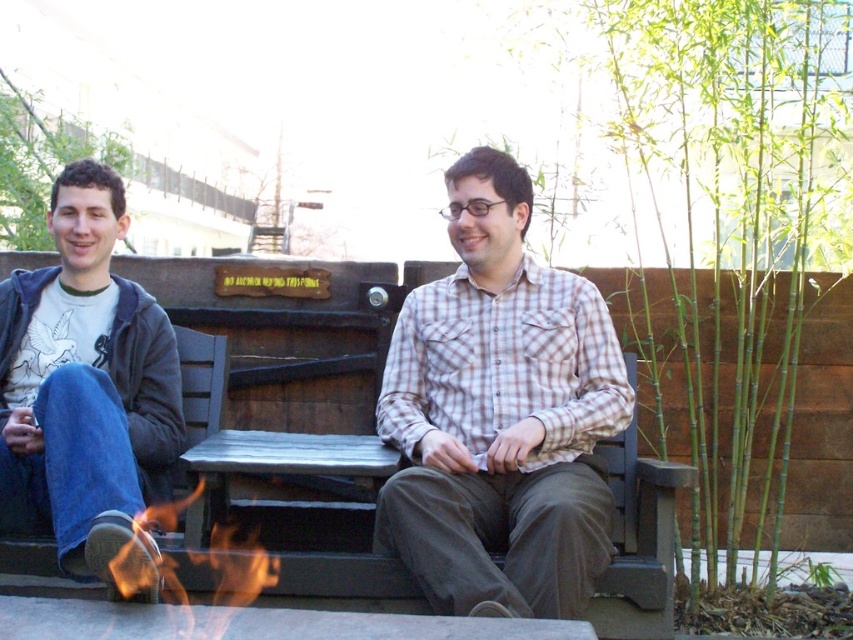
Question: Observing the image, what is the correct spatial positioning of matte plaid shirt at center in reference to flame/yellow-orange at lower center?

Choices:
 (A) below
 (B) above

Answer: (B)

Question: Does matte plaid shirt at center have a lesser width compared to flame/yellow-orange at lower center?

Choices:
 (A) yes
 (B) no

Answer: (B)

Question: Which point is closer to the camera?

Choices:
 (A) (473, 202)
 (B) (229, 532)
 (C) (80, 280)
 (D) (619, 365)

Answer: (A)

Question: Considering the real-world distances, which object is closest to the matte plaid shirt at center?

Choices:
 (A) flame/yellow-orange at lower center
 (B) denim jacket at left

Answer: (B)

Question: Which point is closer to the camera?

Choices:
 (A) (54, 436)
 (B) (503, 272)

Answer: (A)

Question: Considering the relative positions of matte plaid shirt at center and plaid cotton shirt at center in the image provided, where is matte plaid shirt at center located with respect to plaid cotton shirt at center?

Choices:
 (A) right
 (B) left

Answer: (B)